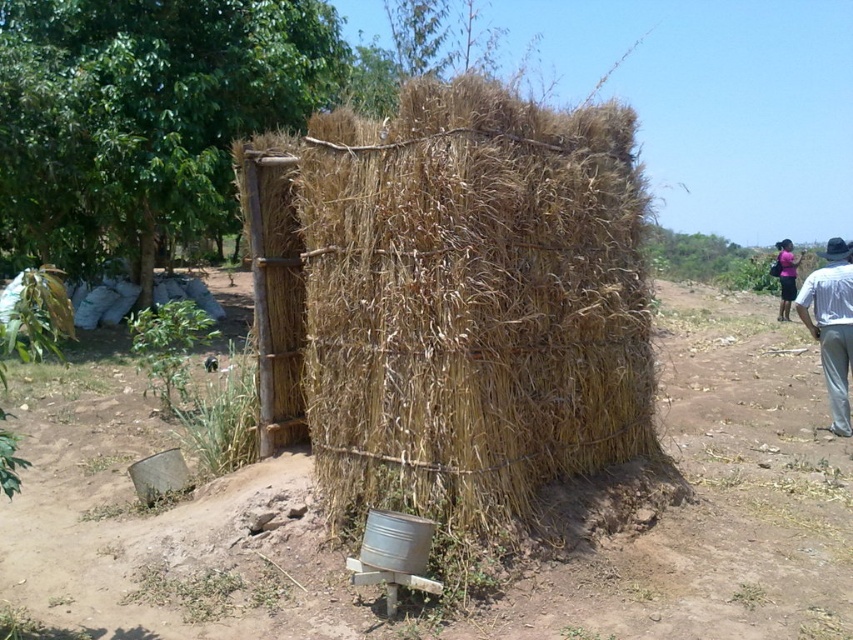
You are standing at the origin point of the coordinate system. The dry straw hut at center is located at point (x=451, y=300). Can you determine if the dry straw hut at center is positioned to the right or left of the origin?

The dry straw hut at center is located at point (x=451, y=300). Since the x coordinate is 0.470, which is greater than 0, the dry straw hut at center is positioned to the right of the origin.

You are standing in front of the dry straw hut at center and the pink fabric dress at upper right. Which object is positioned to the left?

The dry straw hut at center is positioned to the left of the pink fabric dress at upper right.